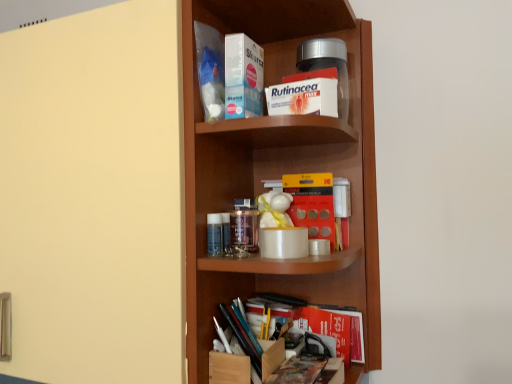
The height and width of the screenshot is (384, 512). I want to click on blue plastic box at upper center, the fourth book when ordered from bottom to top, so click(243, 77).

Measure the distance between white cardboard box at upper center, which ranks as the third book in top-to-bottom order, and camera.

white cardboard box at upper center, which ranks as the third book in top-to-bottom order, is 27.18 inches from camera.

The height and width of the screenshot is (384, 512). What do you see at coordinates (318, 205) in the screenshot?
I see `yellow matte kodak film at center, arranged as the fourth book when viewed from the top` at bounding box center [318, 205].

Measure the distance between point (236,225) and camera.

The depth of point (236,225) is 33.03 inches.

This screenshot has width=512, height=384. Describe the element at coordinates (92, 196) in the screenshot. I see `wooden shelf at center` at that location.

Where is `blue plastic bag at upper center, which appears as the first book when viewed from the top`? This screenshot has height=384, width=512. blue plastic bag at upper center, which appears as the first book when viewed from the top is located at coordinates (210, 70).

Would you say transparent glass jar at center is outside blue plastic box at upper center, the fourth book when ordered from bottom to top?

transparent glass jar at center is positioned outside blue plastic box at upper center, the fourth book when ordered from bottom to top.

How distant is transparent glass jar at center from blue plastic box at upper center, the fourth book when ordered from bottom to top?

The distance of transparent glass jar at center from blue plastic box at upper center, the fourth book when ordered from bottom to top, is 10.13 inches.

Is point (252, 219) positioned behind point (234, 43)?

Yes, point (252, 219) is farther from viewer.

In the scene shown: Is transparent glass jar at center oriented towards blue plastic box at upper center, the fourth book when ordered from bottom to top?

No, transparent glass jar at center is not oriented towards blue plastic box at upper center, the fourth book when ordered from bottom to top.

Is blue plastic bag at upper center, which is counted as the fifth book, starting from the bottom, taller than blue plastic box at upper center, the fourth book when ordered from bottom to top?

Correct, blue plastic bag at upper center, which is counted as the fifth book, starting from the bottom, is much taller as blue plastic box at upper center, the fourth book when ordered from bottom to top.

From a real-world perspective, relative to blue plastic box at upper center, the fourth book when ordered from bottom to top, is blue plastic bag at upper center, which is counted as the fifth book, starting from the bottom, vertically above or below?

In terms of real-world spatial position, blue plastic bag at upper center, which is counted as the fifth book, starting from the bottom, is above blue plastic box at upper center, the fourth book when ordered from bottom to top.

Considering their positions, is blue plastic bag at upper center, which is counted as the fifth book, starting from the bottom, located in front of or behind blue plastic box at upper center, the fourth book when ordered from bottom to top?

Visually, blue plastic bag at upper center, which is counted as the fifth book, starting from the bottom, is located behind blue plastic box at upper center, the fourth book when ordered from bottom to top.

Is blue plastic bag at upper center, which is counted as the fifth book, starting from the bottom, not close to blue plastic box at upper center, the fourth book when ordered from bottom to top?

blue plastic bag at upper center, which is counted as the fifth book, starting from the bottom, is near blue plastic box at upper center, the fourth book when ordered from bottom to top, not far away.

Which of these two, yellow matte kodak film at center, arranged as the 2th book when ordered from the bottom, or blue plastic bag at upper center, which is counted as the fifth book, starting from the bottom, is thinner?

yellow matte kodak film at center, arranged as the 2th book when ordered from the bottom, is thinner.

From a real-world perspective, is yellow matte kodak film at center, arranged as the fourth book when viewed from the top, beneath blue plastic bag at upper center, which is counted as the fifth book, starting from the bottom?

Correct, in the physical world, yellow matte kodak film at center, arranged as the fourth book when viewed from the top, is lower than blue plastic bag at upper center, which is counted as the fifth book, starting from the bottom.

Between point (339, 206) and point (204, 116), which one is positioned in front?

Point (204, 116)

At what (x,y) coordinates should I click in order to perform the action: click on door above the yellow matte kodak film at center, arranged as the fourth book when viewed from the top (from the image's perspective). Please return your answer as a coordinate pair (x, y). The width and height of the screenshot is (512, 384). Looking at the image, I should click on (93, 195).

Is yellow matte kodak film at center, arranged as the fourth book when viewed from the top, bigger than matte yellow door at left?

No, yellow matte kodak film at center, arranged as the fourth book when viewed from the top, is not bigger than matte yellow door at left.

From the image's perspective, would you say yellow matte kodak film at center, arranged as the fourth book when viewed from the top, is positioned over matte yellow door at left?

No.

From a real-world perspective, between blue plastic bag at upper center, which is counted as the fifth book, starting from the bottom, and white cardboard box at upper center, arranged as the third book when ordered from the bottom, who is vertically lower?

white cardboard box at upper center, arranged as the third book when ordered from the bottom.

What's the angular difference between blue plastic bag at upper center, which appears as the first book when viewed from the top, and white cardboard box at upper center, arranged as the third book when ordered from the bottom,'s facing directions?

94.3 degrees.

Is blue plastic bag at upper center, which is counted as the fifth book, starting from the bottom, facing towards white cardboard box at upper center, arranged as the third book when ordered from the bottom?

Yes, blue plastic bag at upper center, which is counted as the fifth book, starting from the bottom, is turned towards white cardboard box at upper center, arranged as the third book when ordered from the bottom.

Find the location of a particular element. The width and height of the screenshot is (512, 384). the 2nd book in front of the red paper book at lower center, which is the 5th book from top to bottom is located at coordinates (210, 70).

Is blue plastic bag at upper center, which is counted as the fifth book, starting from the bottom, a part of red paper book at lower center, positioned as the 1th book in bottom-to-top order?

That's incorrect, blue plastic bag at upper center, which is counted as the fifth book, starting from the bottom, is not inside red paper book at lower center, positioned as the 1th book in bottom-to-top order.

Which of these two, red paper book at lower center, which is the 5th book from top to bottom, or blue plastic bag at upper center, which appears as the first book when viewed from the top, stands taller?

blue plastic bag at upper center, which appears as the first book when viewed from the top, is taller.

In the scene shown: Is red paper book at lower center, which is the 5th book from top to bottom, facing towards blue plastic bag at upper center, which appears as the first book when viewed from the top?

No, red paper book at lower center, which is the 5th book from top to bottom, does not turn towards blue plastic bag at upper center, which appears as the first book when viewed from the top.

Based on the photo, considering the sizes of objects red paper book at lower center, which is the 5th book from top to bottom, and blue plastic box at upper center, which ranks as the second book in top-to-bottom order, in the image provided, who is bigger, red paper book at lower center, which is the 5th book from top to bottom, or blue plastic box at upper center, which ranks as the second book in top-to-bottom order,?

blue plastic box at upper center, which ranks as the second book in top-to-bottom order.

Which object is thinner, red paper book at lower center, positioned as the 1th book in bottom-to-top order, or blue plastic box at upper center, the fourth book when ordered from bottom to top?

With smaller width is red paper book at lower center, positioned as the 1th book in bottom-to-top order.

Does red paper book at lower center, positioned as the 1th book in bottom-to-top order, have a lesser height compared to blue plastic box at upper center, which ranks as the second book in top-to-bottom order?

Yes.

From a real-world perspective, is red paper book at lower center, which is the 5th book from top to bottom, above or below blue plastic box at upper center, the fourth book when ordered from bottom to top?

Clearly, from a real-world perspective, red paper book at lower center, which is the 5th book from top to bottom, is below blue plastic box at upper center, the fourth book when ordered from bottom to top.

The width and height of the screenshot is (512, 384). In the image, there is a blue plastic box at upper center, the fourth book when ordered from bottom to top. Find the location of `glass jar below it (from a real-world perspective)`. glass jar below it (from a real-world perspective) is located at coordinates (244, 231).

From the image's perspective, count 1st books downward from the blue plastic bag at upper center, which is counted as the fifth book, starting from the bottom, and point to it. Please provide its 2D coordinates.

[(243, 77)]

Estimate the real-world distances between objects in this image. Which object is closer to matte yellow door at left, transparent glass jar at center or blue plastic box at upper center, the fourth book when ordered from bottom to top?

transparent glass jar at center is closer to matte yellow door at left.

Looking at the image, which one is located closer to red paper book at lower center, positioned as the 1th book in bottom-to-top order, blue plastic box at upper center, which ranks as the second book in top-to-bottom order, or white cardboard box at upper center, which ranks as the third book in top-to-bottom order?

white cardboard box at upper center, which ranks as the third book in top-to-bottom order.

Looking at this image, estimate the real-world distances between objects in this image. Which object is further from white cardboard box at upper center, which ranks as the third book in top-to-bottom order, wooden shelf at center or transparent glass jar at center?

The object further to white cardboard box at upper center, which ranks as the third book in top-to-bottom order, is wooden shelf at center.

From the image, which object appears to be farther from white cardboard box at upper center, which ranks as the third book in top-to-bottom order, wooden shelf at center or red paper book at lower center, which is the 5th book from top to bottom?

The object further to white cardboard box at upper center, which ranks as the third book in top-to-bottom order, is red paper book at lower center, which is the 5th book from top to bottom.

Based on their spatial positions, is transparent glass jar at center or matte yellow door at left closer to yellow matte kodak film at center, arranged as the 2th book when ordered from the bottom?

transparent glass jar at center is positioned closer to the anchor yellow matte kodak film at center, arranged as the 2th book when ordered from the bottom.

Estimate the real-world distances between objects in this image. Which object is further from blue plastic bag at upper center, which appears as the first book when viewed from the top, wooden shelf at center or blue plastic box at upper center, the fourth book when ordered from bottom to top?

wooden shelf at center lies further to blue plastic bag at upper center, which appears as the first book when viewed from the top, than the other object.

When comparing their distances from wooden shelf at center, does yellow matte kodak film at center, arranged as the fourth book when viewed from the top, or white cardboard box at upper center, which ranks as the third book in top-to-bottom order, seem further?

white cardboard box at upper center, which ranks as the third book in top-to-bottom order, is positioned further to the anchor wooden shelf at center.

When comparing their distances from wooden shelf at center, does blue plastic box at upper center, which ranks as the second book in top-to-bottom order, or blue plastic bag at upper center, which is counted as the fifth book, starting from the bottom, seem further?

blue plastic box at upper center, which ranks as the second book in top-to-bottom order, lies further to wooden shelf at center than the other object.

I want to click on glass jar between matte yellow door at left and blue plastic box at upper center, which ranks as the second book in top-to-bottom order, in the horizontal direction, so coord(244,231).

Identify the location of book between matte yellow door at left and transparent glass jar at center in the horizontal direction. (210, 70).

Find the location of a particular element. shelf between blue plastic bag at upper center, which appears as the first book when viewed from the top, and red paper book at lower center, which is the 5th book from top to bottom, in the up-down direction is located at coordinates (92, 196).

Find the location of `glass jar that lies between wooden shelf at center and red paper book at lower center, positioned as the 1th book in bottom-to-top order, from top to bottom`. glass jar that lies between wooden shelf at center and red paper book at lower center, positioned as the 1th book in bottom-to-top order, from top to bottom is located at coordinates (244, 231).